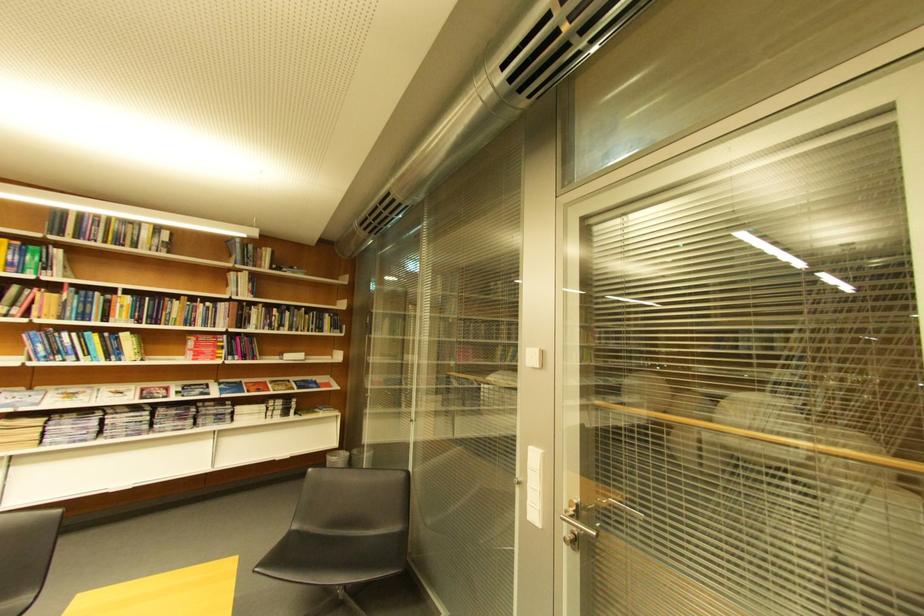
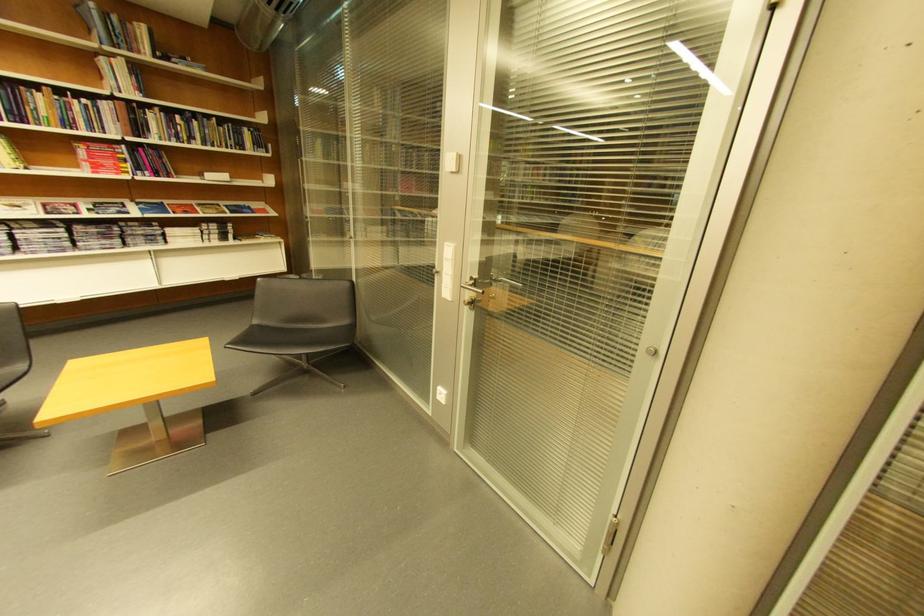
Find the pixel in the second image that matches pixel 185 317 in the first image.

(54, 116)